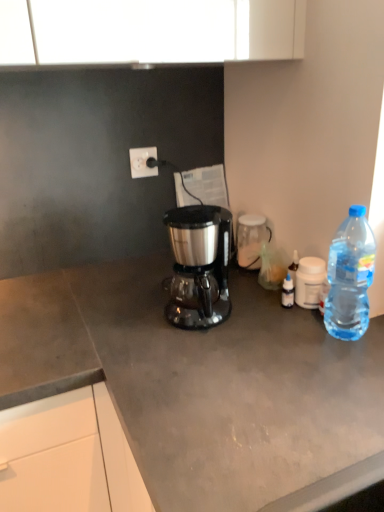
At what (x,y) coordinates should I click in order to perform the action: click on blank space situated above matte gray countertop at center (from a real-world perspective). Please return your answer as a coordinate pair (x, y). The width and height of the screenshot is (384, 512). Looking at the image, I should click on (103, 304).